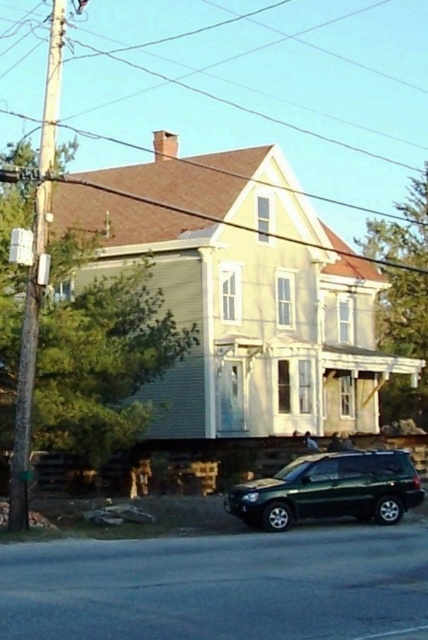
Question: Which point is closer to the camera?

Choices:
 (A) shiny dark green suv at lower right
 (B) brown wooden pole at left

Answer: (B)

Question: Can you confirm if shiny dark green suv at lower right is positioned above brown wooden pole at left?

Choices:
 (A) yes
 (B) no

Answer: (B)

Question: Which point is closer to the camera taking this photo?

Choices:
 (A) (21, 440)
 (B) (234, 490)

Answer: (A)

Question: Does shiny dark green suv at lower right have a smaller size compared to brown wooden pole at left?

Choices:
 (A) no
 (B) yes

Answer: (B)

Question: Where is shiny dark green suv at lower right located in relation to brown wooden pole at left in the image?

Choices:
 (A) above
 (B) below

Answer: (B)